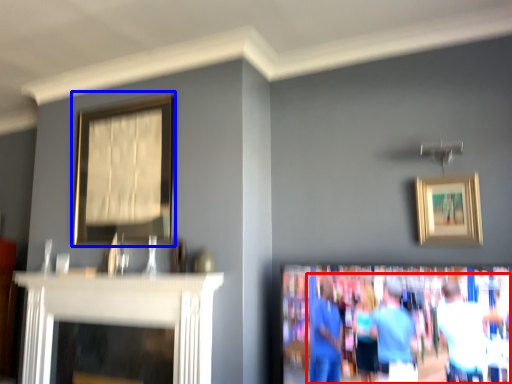
Question: Which of the following is the closest to the observer, couple (highlighted by a red box) or picture frame (highlighted by a blue box)?

Choices:
 (A) couple
 (B) picture frame

Answer: (A)